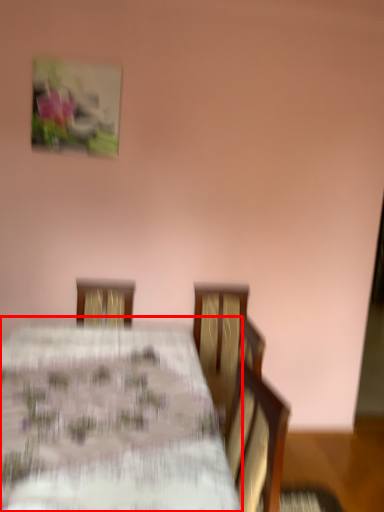
Question: From the image's perspective, where is table (annotated by the red box) located in relation to picture frame in the image?

Choices:
 (A) below
 (B) above

Answer: (A)